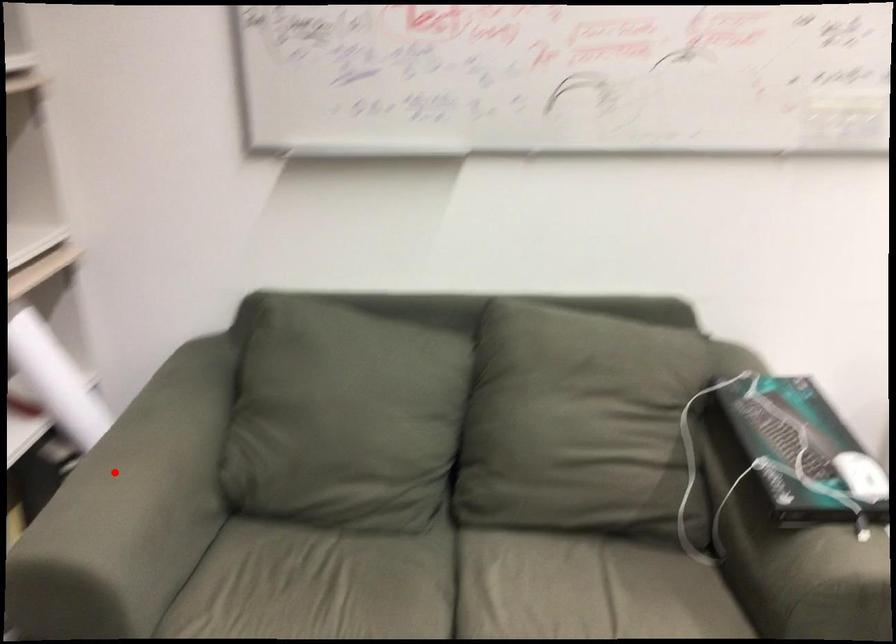
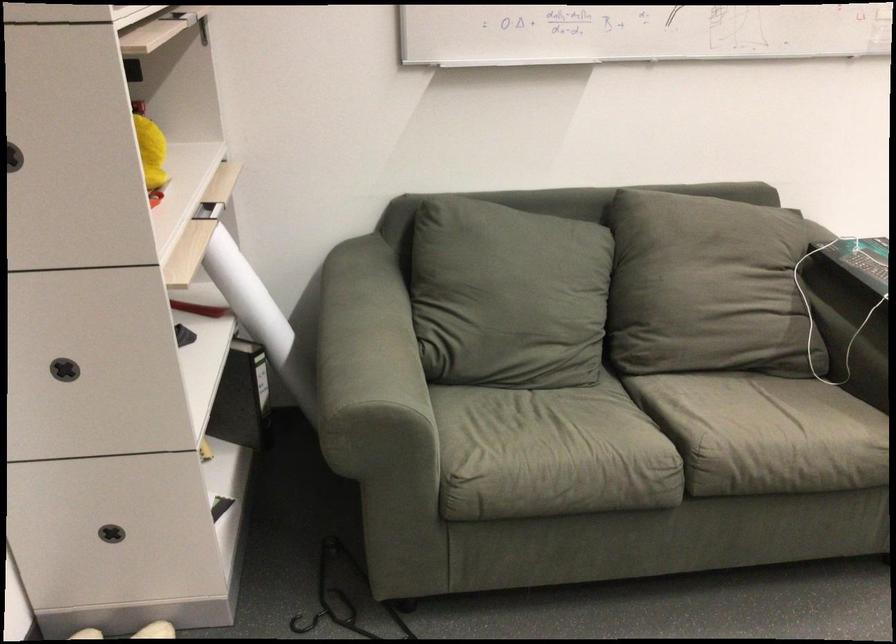
Find the pixel in the second image that matches the highlighted location in the first image.

(358, 342)